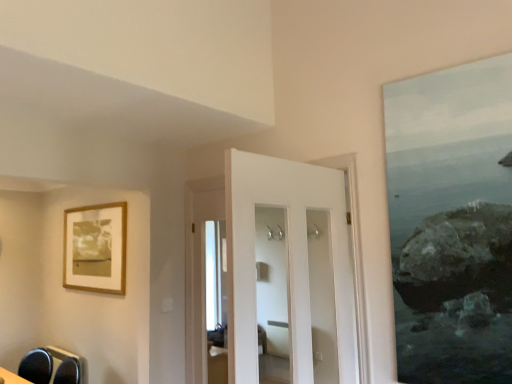
Question: Can you confirm if matte black swivel chair at lower left is positioned to the right of white glossy door at center?

Choices:
 (A) no
 (B) yes

Answer: (A)

Question: Can you confirm if matte black swivel chair at lower left is positioned to the left of white glossy door at center?

Choices:
 (A) no
 (B) yes

Answer: (B)

Question: Is matte black swivel chair at lower left positioned far away from white glossy door at center?

Choices:
 (A) yes
 (B) no

Answer: (A)

Question: Could you tell me if matte black swivel chair at lower left is turned towards white glossy door at center?

Choices:
 (A) yes
 (B) no

Answer: (B)

Question: Is matte black swivel chair at lower left turned away from white glossy door at center?

Choices:
 (A) yes
 (B) no

Answer: (B)

Question: From the image's perspective, is white glossy door at center positioned above or below wooden frame at upper left?

Choices:
 (A) above
 (B) below

Answer: (B)

Question: In terms of size, does white glossy door at center appear bigger or smaller than wooden frame at upper left?

Choices:
 (A) big
 (B) small

Answer: (A)

Question: Is white glossy door at center wider or thinner than wooden frame at upper left?

Choices:
 (A) wide
 (B) thin

Answer: (A)

Question: In the image, is white glossy door at center on the left side or the right side of wooden frame at upper left?

Choices:
 (A) right
 (B) left

Answer: (A)

Question: Considering the positions of matte black swivel chair at lower left and white glossy door at center in the image, is matte black swivel chair at lower left bigger or smaller than white glossy door at center?

Choices:
 (A) small
 (B) big

Answer: (A)

Question: Considering the relative positions of matte black swivel chair at lower left and white glossy door at center in the image provided, is matte black swivel chair at lower left to the left or to the right of white glossy door at center?

Choices:
 (A) right
 (B) left

Answer: (B)

Question: Looking at their shapes, would you say matte black swivel chair at lower left is wider or thinner than white glossy door at center?

Choices:
 (A) thin
 (B) wide

Answer: (B)

Question: Relative to white glossy door at center, is matte black swivel chair at lower left in front or behind?

Choices:
 (A) front
 (B) behind

Answer: (B)

Question: Is wooden frame at upper left bigger or smaller than white glossy door at center?

Choices:
 (A) small
 (B) big

Answer: (A)

Question: Is wooden frame at upper left situated inside white glossy door at center or outside?

Choices:
 (A) outside
 (B) inside

Answer: (A)